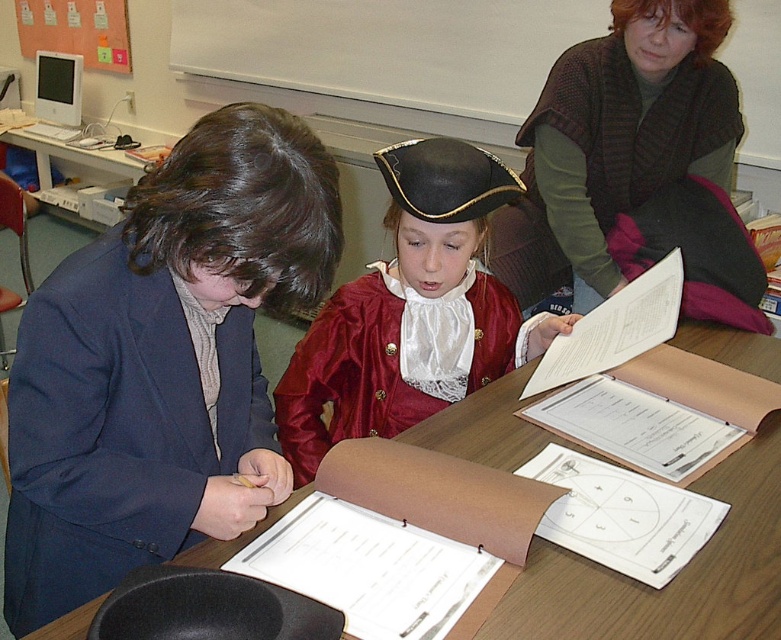
You are a student in the classroom and want to place a 1.5 meter tall poster on the wall behind the blue fabric jacket at left and wooden table at center. Which object would require you to stand on a chair to reach the wall behind it?

The blue fabric jacket at left is much taller than the wooden table at center, so you would need to stand on a chair to reach the wall behind the blue fabric jacket at left since it is taller and the poster may be placed higher.

You are standing in the classroom and need to hand a document to the person wearing the blue fabric jacket at left. The document must be placed on the wooden table at center. Can you determine the direction you should move to reach the jacket first before placing the document on the table?

A: The blue fabric jacket at left is to the left of the wooden table at center, so you should move to the left to reach the jacket first before placing the document on the table.

You are organizing a school event and need to arrange seating based on the space each clothing item takes up. If you have a limited space area, which clothing item should you prioritize placing first, the blue fabric jacket at left or the green sweater at upper right?

The blue fabric jacket at left occupies less space than the green sweater at upper right, so you should prioritize placing the green sweater at upper right first since it requires more space.